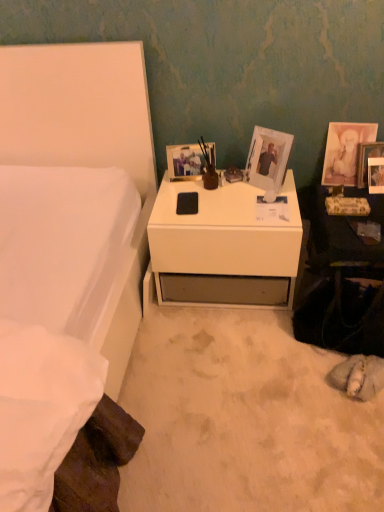
In order to click on unoccupied area in front of green floral magazine at right in this screenshot , I will do `click(355, 230)`.